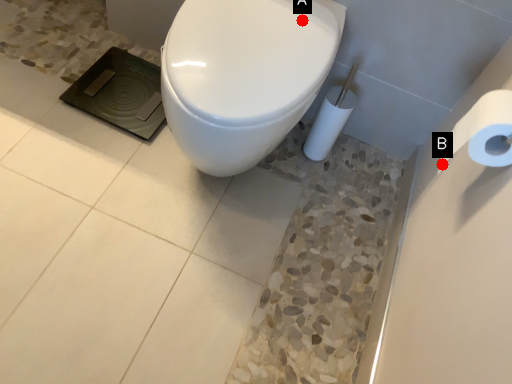
Question: Two points are circled on the image, labeled by A and B beside each circle. Among these points, which one is nearest to the camera?

Choices:
 (A) A is closer
 (B) B is closer

Answer: (B)